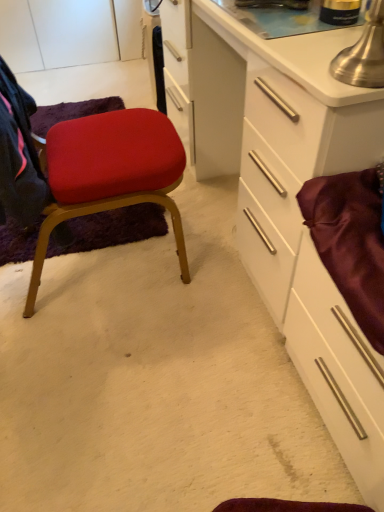
This screenshot has height=512, width=384. Find the location of `free space to the back side of metallic silver table lamp at upper right`. free space to the back side of metallic silver table lamp at upper right is located at coordinates (310, 47).